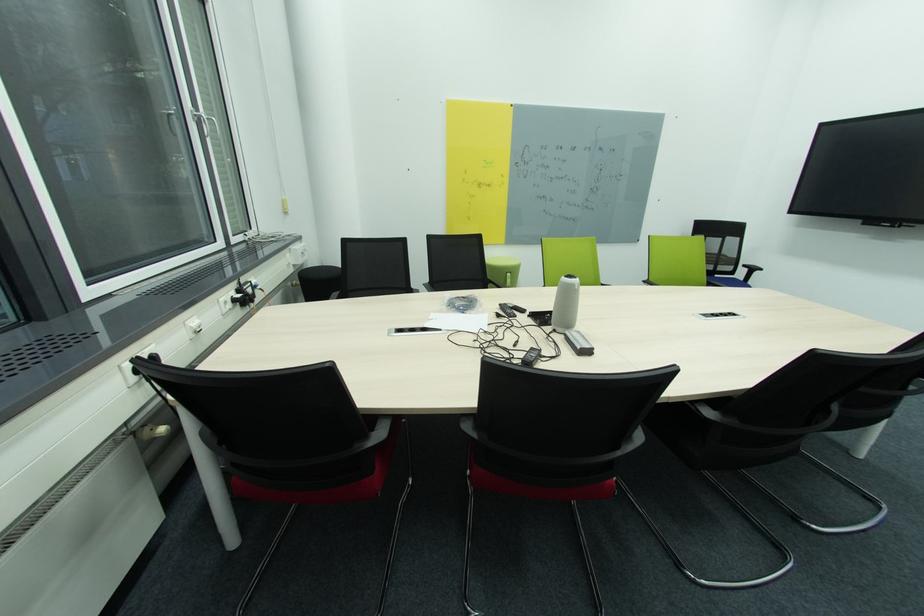
Find where to sit the green chair sitting surface. Please return your answer as a coordinate pair (x, y).

(503, 267)